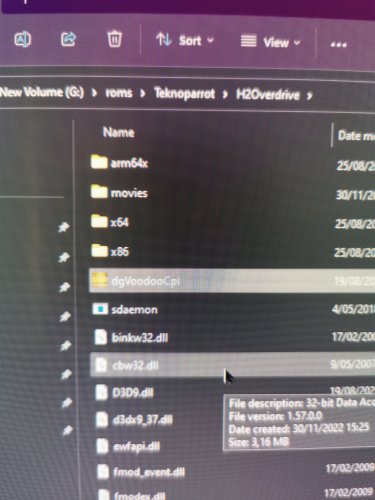
Locate an element on the screen. The height and width of the screenshot is (500, 375). file folders is located at coordinates (89, 159), (93, 193), (96, 221), (99, 254).